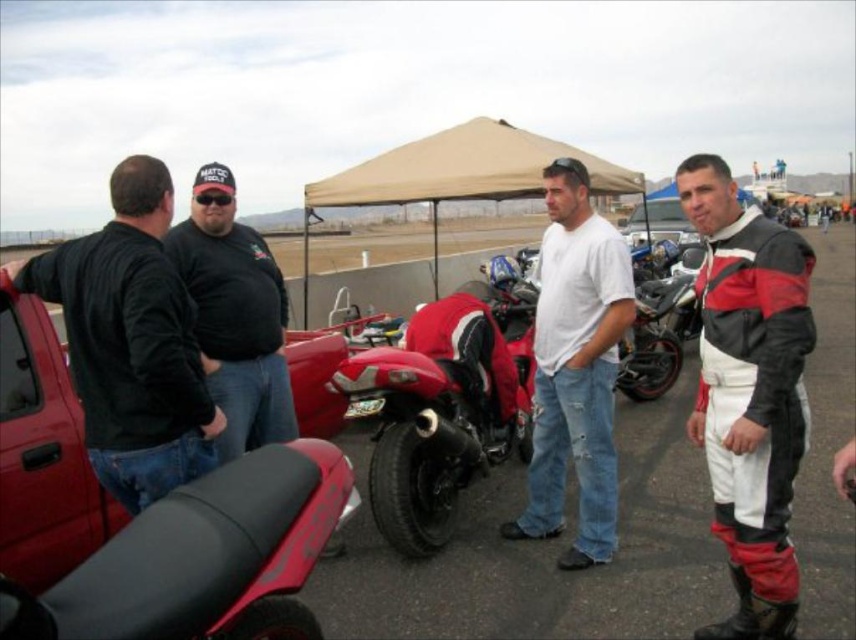
Question: Is black rubber motorcycle at center positioned at the back of shiny red motorcycle at center?

Choices:
 (A) no
 (B) yes

Answer: (A)

Question: Can you confirm if black rubber motorcycle at center is thinner than shiny red motorcycle at center?

Choices:
 (A) no
 (B) yes

Answer: (A)

Question: Among these objects, which one is nearest to the camera?

Choices:
 (A) white cotton t-shirt at center
 (B) leather jacket at right
 (C) shiny red motorcycle at center
 (D) black leather jacket at left

Answer: (D)

Question: Which point is farther from the camera taking this photo?

Choices:
 (A) (470, 339)
 (B) (609, 426)
 (C) (801, 316)

Answer: (A)

Question: In this image, where is black rubber motorcycle at center located relative to black matte shirt at center?

Choices:
 (A) above
 (B) below

Answer: (A)

Question: Based on their relative distances, which object is nearer to the white cotton t-shirt at center?

Choices:
 (A) leather jacket at right
 (B) black matte shirt at center
 (C) shiny red motorcycle at center
 (D) black leather jacket at left

Answer: (C)